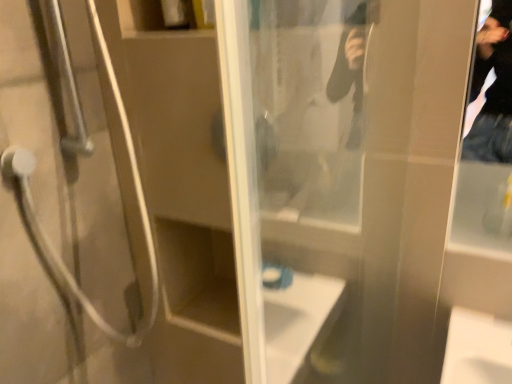
What do you see at coordinates (68, 207) in the screenshot? The image size is (512, 384). I see `metallic silver shower door at left` at bounding box center [68, 207].

At what (x,y) coordinates should I click in order to perform the action: click on metallic silver shower door at left. Please return your answer as a coordinate pair (x, y). Image resolution: width=512 pixels, height=384 pixels. Looking at the image, I should click on (68, 207).

The width and height of the screenshot is (512, 384). Find the location of `transparent glass screen door at center`. transparent glass screen door at center is located at coordinates (360, 167).

Describe the element at coordinates (360, 167) in the screenshot. This screenshot has height=384, width=512. I see `transparent glass screen door at center` at that location.

Where is `metallic silver shower door at left`? The width and height of the screenshot is (512, 384). metallic silver shower door at left is located at coordinates (68, 207).

In the image, is metallic silver shower door at left on the left side or the right side of transparent glass screen door at center?

Clearly, metallic silver shower door at left is on the left of transparent glass screen door at center in the image.

Is metallic silver shower door at left in front of or behind transparent glass screen door at center in the image?

Visually, metallic silver shower door at left is located behind transparent glass screen door at center.

Considering the points (136, 217) and (453, 159), which point is behind, point (136, 217) or point (453, 159)?

The point (136, 217) is more distant.

Based on the photo, from the image's perspective, is metallic silver shower door at left beneath transparent glass screen door at center?

Actually, metallic silver shower door at left appears above transparent glass screen door at center in the image.

From a real-world perspective, between metallic silver shower door at left and transparent glass screen door at center, who is vertically lower?

transparent glass screen door at center.

Considering the sizes of objects metallic silver shower door at left and transparent glass screen door at center in the image provided, who is wider, metallic silver shower door at left or transparent glass screen door at center?

With larger width is metallic silver shower door at left.

Considering the relative sizes of metallic silver shower door at left and transparent glass screen door at center in the image provided, is metallic silver shower door at left shorter than transparent glass screen door at center?

Correct, metallic silver shower door at left is not as tall as transparent glass screen door at center.

Can you confirm if metallic silver shower door at left is bigger than transparent glass screen door at center?

Indeed, metallic silver shower door at left has a larger size compared to transparent glass screen door at center.

Is transparent glass screen door at center completely or partially inside metallic silver shower door at left?

No, transparent glass screen door at center is located outside of metallic silver shower door at left.

Is metallic silver shower door at left touching transparent glass screen door at center?

No, metallic silver shower door at left is not beside transparent glass screen door at center.

From the picture: Is metallic silver shower door at left facing towards transparent glass screen door at center?

No, metallic silver shower door at left does not turn towards transparent glass screen door at center.

In the image, there is a transparent glass screen door at center. Identify the location of shower door above it (from the image's perspective). Image resolution: width=512 pixels, height=384 pixels. (68, 207).

Is transparent glass screen door at center to the left or to the right of metallic silver shower door at left in the image?

transparent glass screen door at center is positioned on metallic silver shower door at left's right side.

Is the depth of transparent glass screen door at center greater than that of metallic silver shower door at left?

No, transparent glass screen door at center is in front of metallic silver shower door at left.

Between point (272, 207) and point (1, 311), which one is positioned behind?

The point (1, 311) is behind.

Looking at this image, from the image's perspective, between transparent glass screen door at center and metallic silver shower door at left, which one is located above?

From the image's view, metallic silver shower door at left is above.

From a real-world perspective, who is located higher, transparent glass screen door at center or metallic silver shower door at left?

metallic silver shower door at left, from a real-world perspective.

Considering the sizes of transparent glass screen door at center and metallic silver shower door at left in the image, is transparent glass screen door at center wider or thinner than metallic silver shower door at left?

In the image, transparent glass screen door at center appears to be more narrow than metallic silver shower door at left.

Considering the sizes of objects transparent glass screen door at center and metallic silver shower door at left in the image provided, who is taller, transparent glass screen door at center or metallic silver shower door at left?

Standing taller between the two is transparent glass screen door at center.

Considering the relative sizes of transparent glass screen door at center and metallic silver shower door at left in the image provided, is transparent glass screen door at center smaller than metallic silver shower door at left?

Yes.

Would you say metallic silver shower door at left is part of transparent glass screen door at center's contents?

No, metallic silver shower door at left is not a part of transparent glass screen door at center.

Is transparent glass screen door at center far away from metallic silver shower door at left?

No.

Is transparent glass screen door at center oriented away from metallic silver shower door at left?

Absolutely, transparent glass screen door at center is directed away from metallic silver shower door at left.

Can you tell me how much transparent glass screen door at center and metallic silver shower door at left differ in facing direction?

They differ by 90.4 degrees in their facing directions.

Identify the location of shower door on the left side of transparent glass screen door at center. (68, 207).

This screenshot has width=512, height=384. Identify the location of shower door behind the transparent glass screen door at center. (68, 207).

Locate an element on the screen. The height and width of the screenshot is (384, 512). screen door that is under the metallic silver shower door at left (from a real-world perspective) is located at coordinates (360, 167).